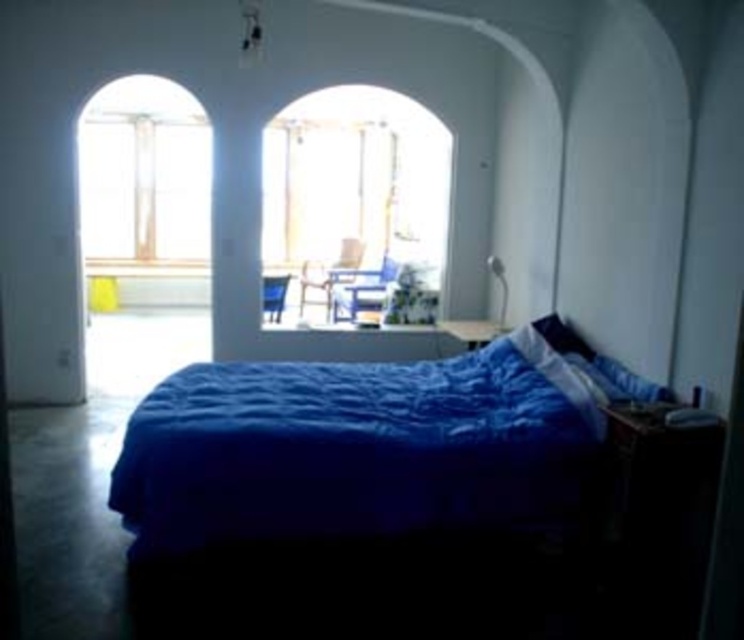
You are trying to decide whether to place a large painting on the wall between the blue quilted bed at center and the clear glass window at upper left. Based on their sizes, which object takes up more horizontal space in the image?

The blue quilted bed at center takes up more horizontal space because its width is larger than that of the clear glass window at upper left.

You are a painter who wants to hang a picture frame that is 1.2 meters tall on the wall. You have two options to choose from in the image. Which object between the blue quilted bed at center and the clear glass window at upper left would you choose to place the frame next to if you want it to be proportionally sized?

The blue quilted bed at center is shorter than the clear glass window at upper left. Since the picture frame is 1.2 meters tall, placing it next to the blue quilted bed at center would ensure the frame is proportionally sized and not too large compared to the bed.

You are trying to hang a wide decorative tapestry on the wall between the clear glass window at center and the wooden chair at center. Based on their widths, can you determine if the tapestry will fit between them without overlapping either object?

The clear glass window at center might be wider than wooden chair at center, so the tapestry may or may not fit depending on the exact widths. You need to measure both to confirm.